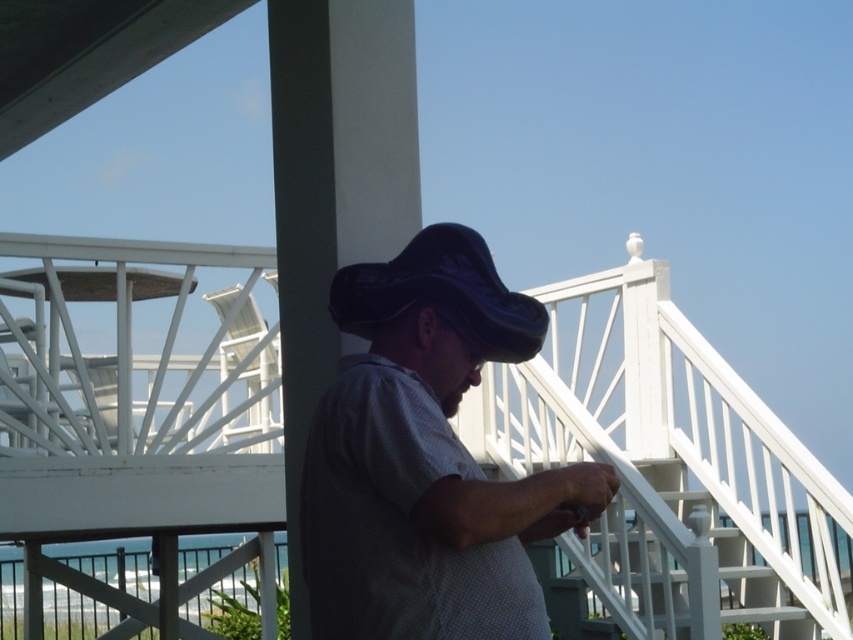
You are a painter who wants to paint the white wooden porch at center and the black leather hat at center. Which object should you paint first if you need to start with the taller one?

The white wooden porch at center is much taller than the black leather hat at center, so you should paint the white wooden porch at center first.

You are a delivery drone trying to land on the white wooden porch at center. The porch is at point (619, 476). To ensure a safe landing, you need to know the exact coordinates. What are the coordinates of the white wooden porch at center?

The coordinates of the white wooden porch at center are point (619, 476).